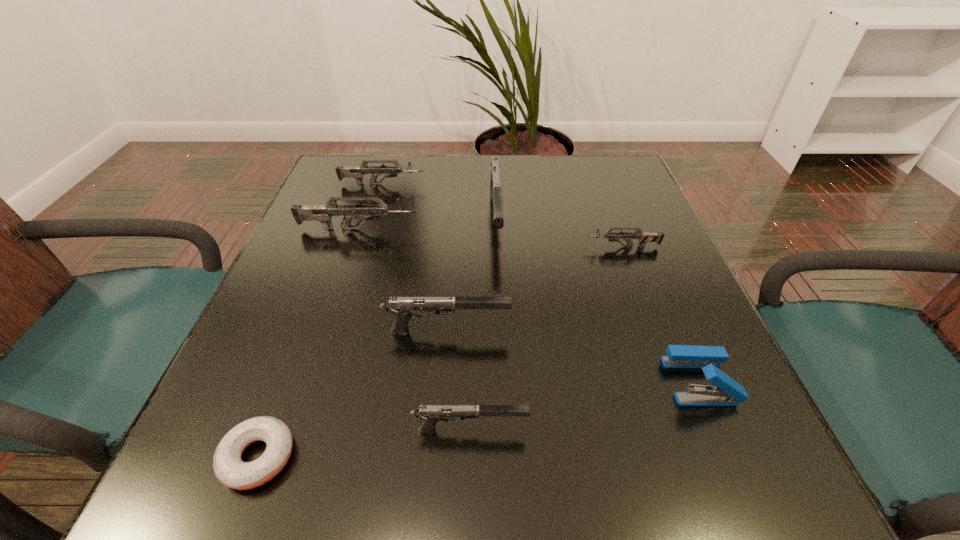
Find the location of `free spot located aimed along the barrel of the nearest grey gun`. free spot located aimed along the barrel of the nearest grey gun is located at coordinates (423, 247).

Identify the location of vacant space located 0.300m aimed along the barrel of the nearest grey gun. (443, 247).

Identify the location of vacant space positioned aimed along the barrel of the nearest grey gun. The height and width of the screenshot is (540, 960). (480, 247).

Where is `free region located 0.060m on the back of the doughnut`? The height and width of the screenshot is (540, 960). free region located 0.060m on the back of the doughnut is located at coordinates (284, 388).

The height and width of the screenshot is (540, 960). I want to click on object present at the near edge, so click(230, 470).

The width and height of the screenshot is (960, 540). What are the coordinates of `doughnut situated at the left edge` in the screenshot? It's located at point(230,470).

Where is `stapler that is positioned at the right edge`? stapler that is positioned at the right edge is located at coordinates (727, 392).

Find the location of a particular element. gun at the right edge is located at coordinates (644, 237).

At what (x,y) coordinates should I click in order to perform the action: click on object present at the far left corner. Please return your answer as a coordinate pair (x, y). This screenshot has height=540, width=960. Looking at the image, I should click on (357, 172).

Where is `object that is at the near left corner`? This screenshot has height=540, width=960. object that is at the near left corner is located at coordinates (230, 470).